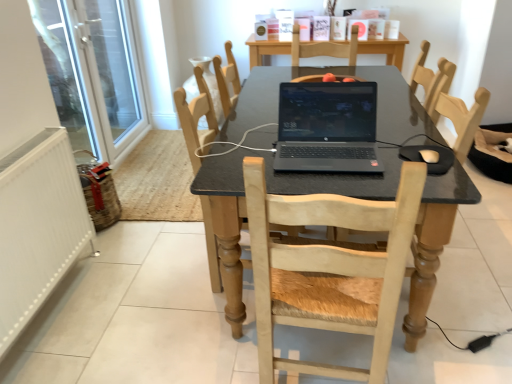
Locate an element on the screen. The height and width of the screenshot is (384, 512). vacant area situated to the left side of light wood chair at center, which ranks as the second chair in front-to-back order is located at coordinates (166, 275).